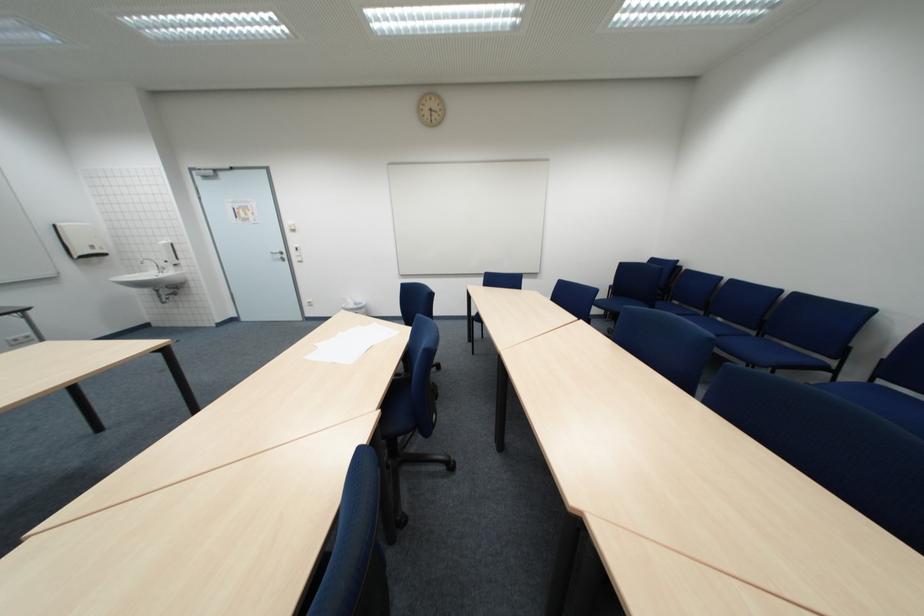
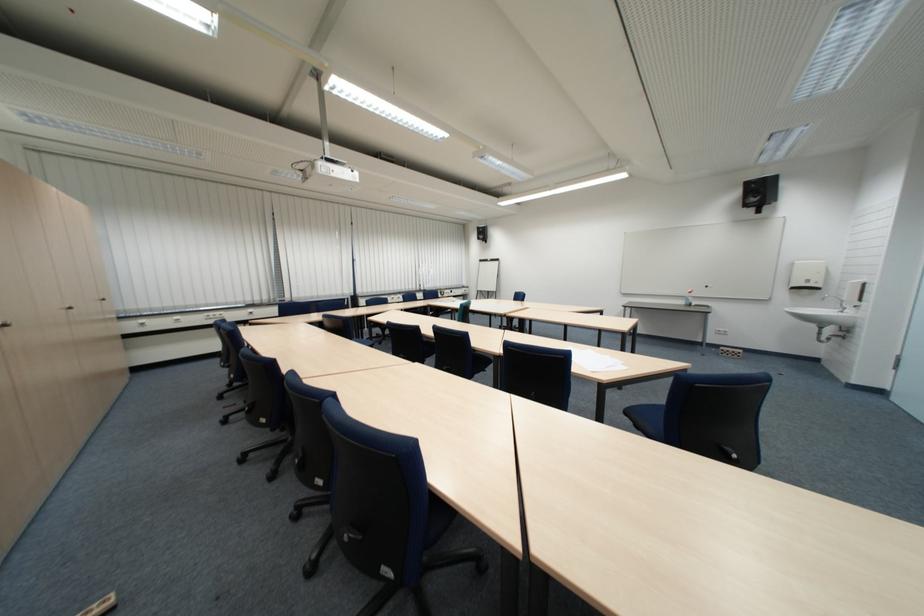
The point at [96,257] is marked in the first image. Where is the corresponding point in the second image?

(807, 290)